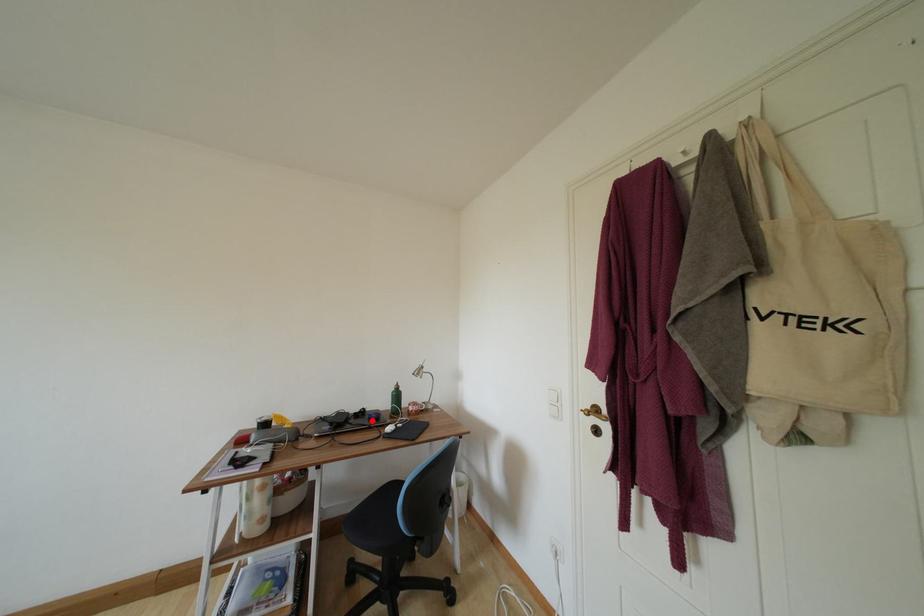
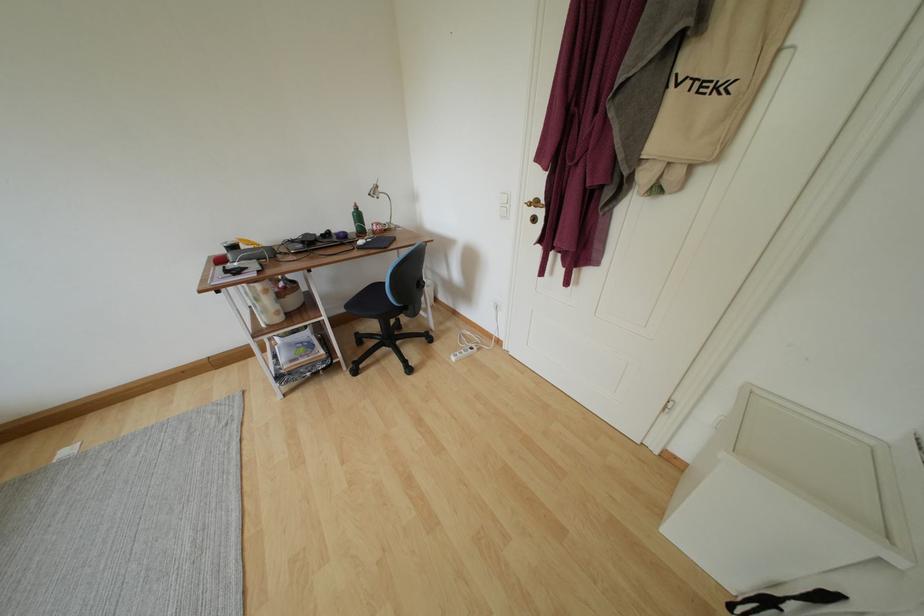
Question: I am providing you with two images of the same scene from different viewpoints. Image1 has a red point marked. In image2, the corresponding 3D location appears at what relative position? Reply with the corresponding letter.

Choices:
 (A) Closer
 (B) Farther

Answer: (A)